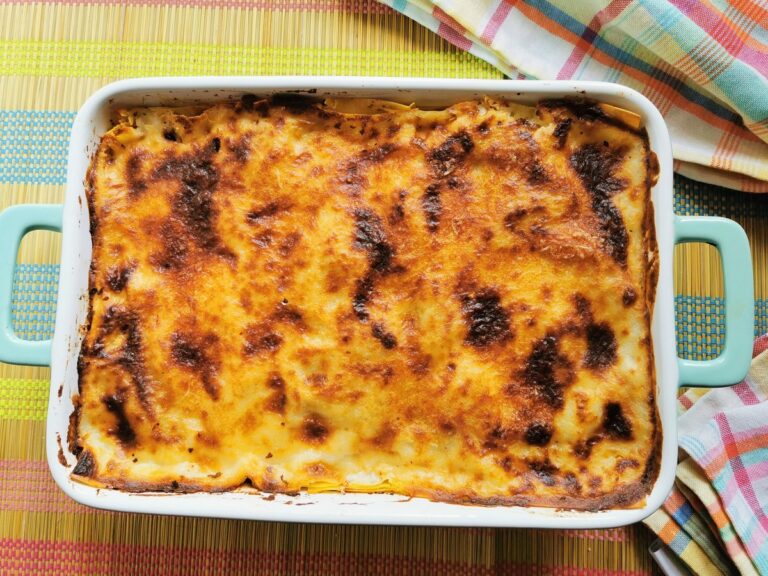
At what (x,y) coordinates should I click in order to perform the action: click on baking pan. Please return your answer as a coordinate pair (x, y). This screenshot has height=576, width=768. Looking at the image, I should click on (326, 510), (356, 87).